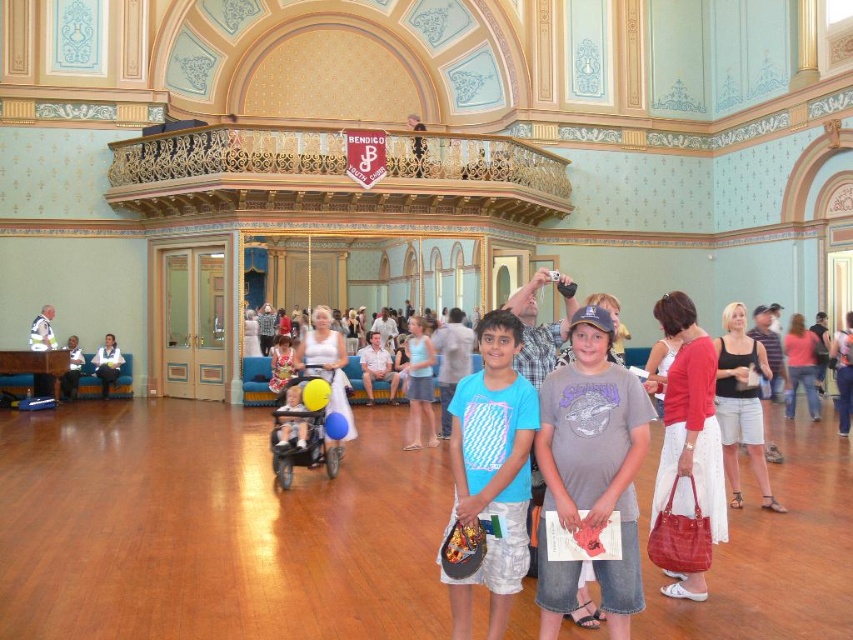
You are a photographer standing at the center of the grand hall. You need to take a photo that includes both the blue cotton shirt at center and the white shirt at lower left. Given that your camera has a maximum focus range of 40 meters, will you be able to capture both shirts in focus?

The blue cotton shirt at center is 40.31 meters away from the white shirt at lower left. Since the distance between them exceeds the camera maximum focus range of 40 meters, you cannot capture both shirts in focus with a single shot.

Looking at this image, you are standing in the grand hall and want to place a small decoration between the two points, point (x=485, y=429) and point (x=71, y=365). Which point should the decoration be closer to in order to appear closer to the viewer?

The decoration should be placed closer to point (x=485, y=429) because it is closer to the viewer than point (x=71, y=365).